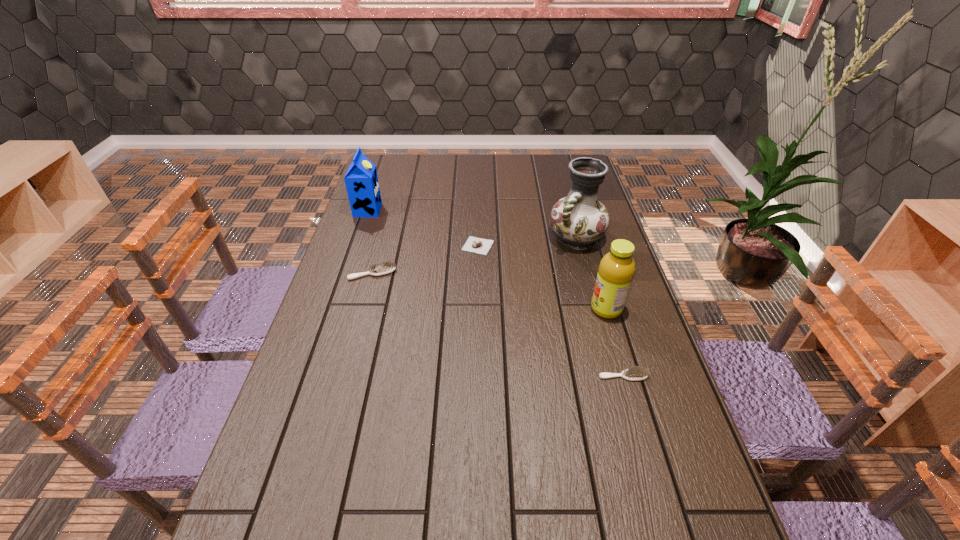
At what (x,y) coordinates should I click in order to perform the action: click on vacant region located on the front label of the second nearest object. Please return your answer as a coordinate pair (x, y). The width and height of the screenshot is (960, 540). Looking at the image, I should click on (516, 309).

The height and width of the screenshot is (540, 960). I want to click on free space located 0.060m on the front label of the second nearest object, so click(569, 309).

Identify the location of vacant space located 0.320m on the front label of the second nearest object. The width and height of the screenshot is (960, 540). (478, 309).

Locate an element on the screen. The height and width of the screenshot is (540, 960). free space located on the front of the tallest object is located at coordinates (602, 335).

Locate an element on the screen. Image resolution: width=960 pixels, height=540 pixels. free space located 0.130m with the cap open on the carton is located at coordinates (416, 210).

This screenshot has width=960, height=540. I want to click on free location located on the front of the fourth object from right to left, so click(477, 328).

Where is `scrubbing brush located at the left edge`? scrubbing brush located at the left edge is located at coordinates (388, 267).

This screenshot has width=960, height=540. I want to click on carton that is at the left edge, so click(361, 180).

Image resolution: width=960 pixels, height=540 pixels. Identify the location of scrubbing brush that is at the right edge. (635, 373).

This screenshot has width=960, height=540. What are the coordinates of `fruit juice located at the right edge` in the screenshot? It's located at (616, 270).